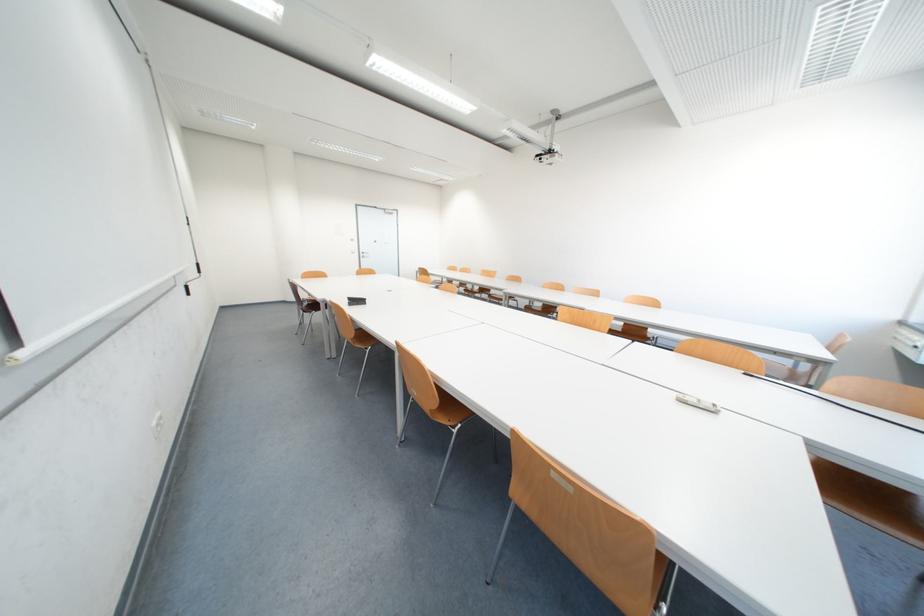
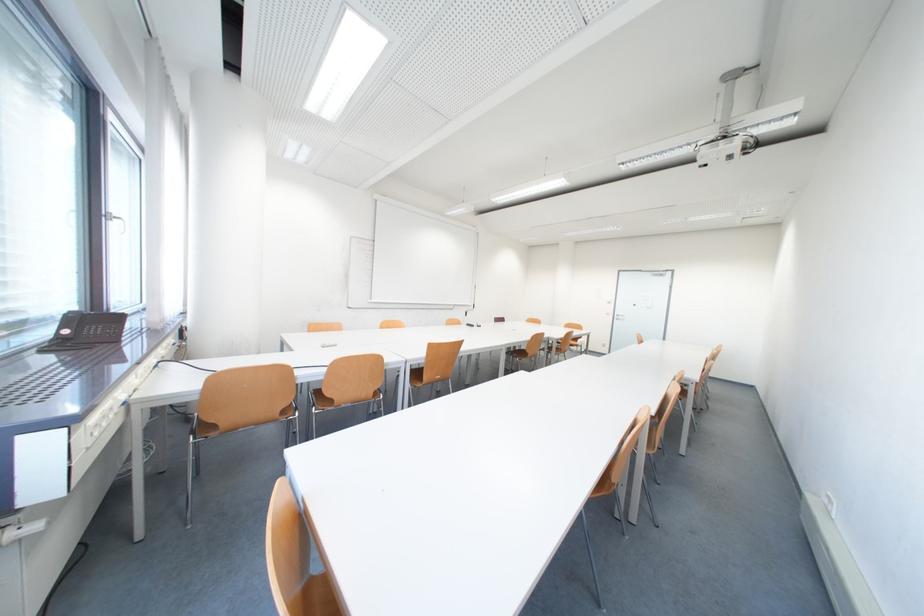
Question: I am providing you with two images of the same scene from different viewpoints. After the viewpoint changes to image2, which objects are now occluded?

Choices:
 (A) brown chair sitting surface
 (B) microwave door handle
 (C) silver window handle
 (D) silver door handle

Answer: (A)